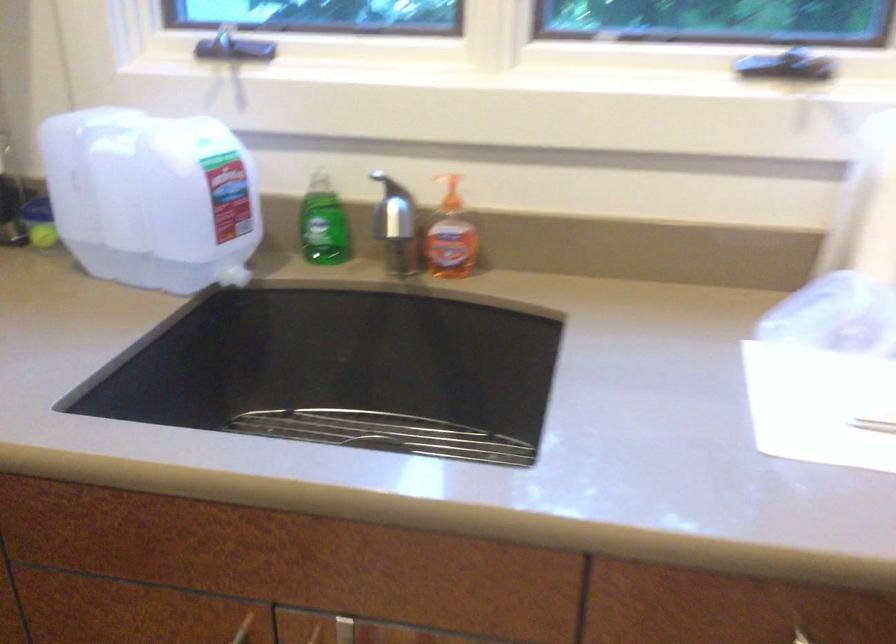
Find where to push the white jug spigot. Please return your answer as a coordinate pair (x, y).

(151, 198)